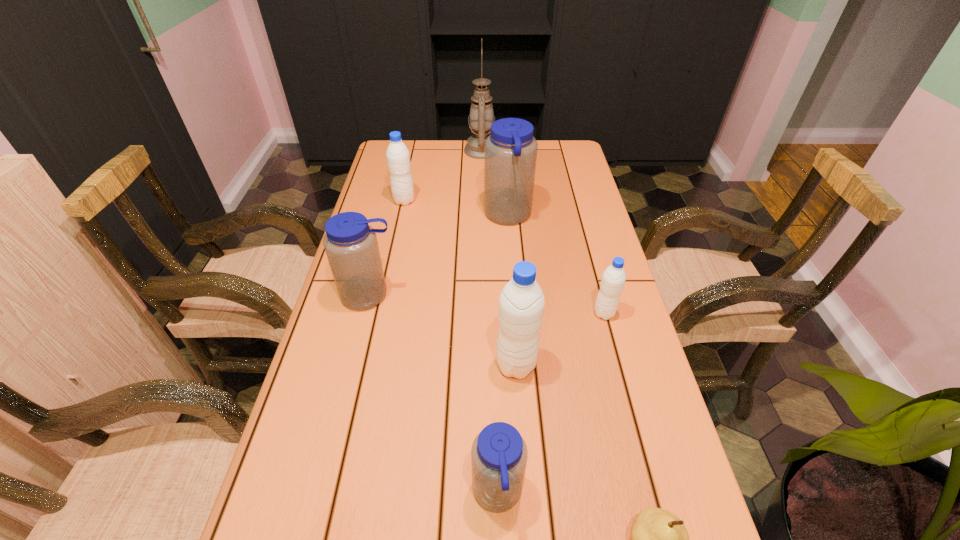
The height and width of the screenshot is (540, 960). In order to click on oil lamp in this screenshot , I will do `click(481, 117)`.

Where is `gray oil lamp`? Image resolution: width=960 pixels, height=540 pixels. gray oil lamp is located at coordinates (481, 117).

At what (x,y) coordinates should I click in order to perform the action: click on the biggest gray water bottle. Please return your answer as a coordinate pair (x, y). Looking at the image, I should click on [521, 303].

The image size is (960, 540). In order to click on the fifth farthest water bottle in this screenshot , I will do `click(521, 303)`.

Image resolution: width=960 pixels, height=540 pixels. Find the location of `the farthest blue water bottle`. the farthest blue water bottle is located at coordinates (510, 153).

In order to click on the farthest gray water bottle in this screenshot , I will do pos(398,157).

This screenshot has height=540, width=960. Identify the location of the second smallest gray water bottle. (398, 157).

I want to click on the second biggest blue water bottle, so click(x=350, y=243).

You are a GUI agent. You are given a task and a screenshot of the screen. Output one action in this format:
    pyautogui.click(x=<x>, y=<y>)
    Task: Click on the second nearest blue water bottle
    Image resolution: width=960 pixels, height=540 pixels.
    Given the screenshot: What is the action you would take?
    pyautogui.click(x=350, y=243)

The width and height of the screenshot is (960, 540). Find the location of `the smallest gray water bottle`. the smallest gray water bottle is located at coordinates (613, 279).